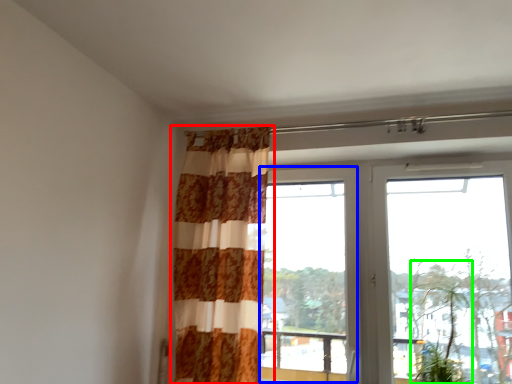
Question: Based on their relative distances, which object is farther from curtain (highlighted by a red box)? Choose from window (highlighted by a blue box) and plant (highlighted by a green box).

Choices:
 (A) window
 (B) plant

Answer: (B)